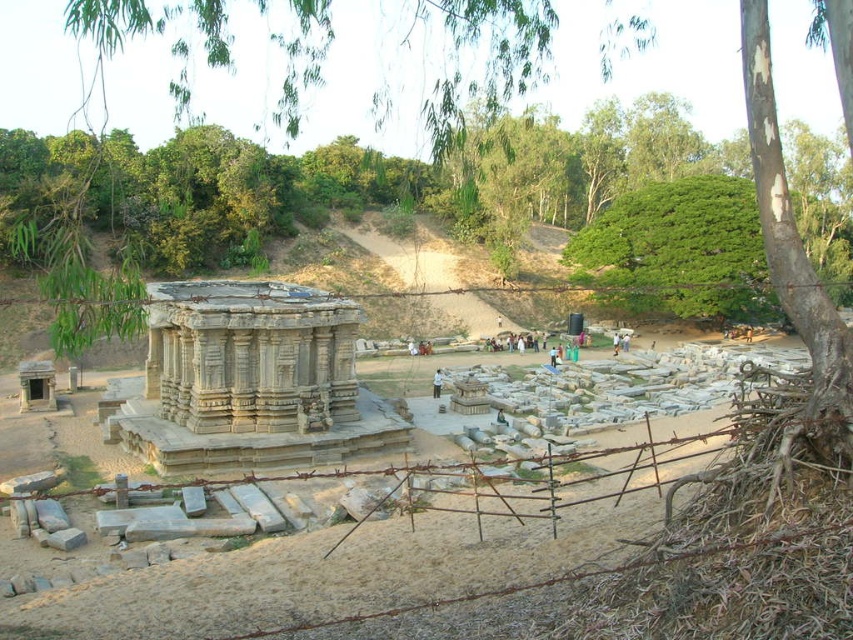
You are a tour guide leading a group through the archaeological site. You want to compare the sizes of the gray stone amphitheater at center and the green leafy tree at upper center. Which one has a smaller width?

The gray stone amphitheater at center has a smaller width than the green leafy tree at upper center.

You are standing at the archaeological site and see a point marked at coordinates (437,381). According to the scene description, what object is this point located on?

The point at (437,381) is located on the white fabric shirt at center.

You are standing at the point marked by coordinates (250, 381) in the archaeological site. What ancient structure are you currently positioned at?

You are positioned at the gray stone amphitheater at center, as the point (250, 381) corresponds to its location.